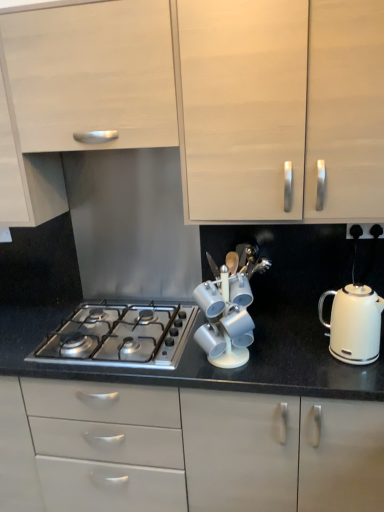
Question: Does white glossy kettle at right have a lesser height compared to stainless steel gas stove at center?

Choices:
 (A) no
 (B) yes

Answer: (A)

Question: Does white glossy kettle at right have a greater width compared to stainless steel gas stove at center?

Choices:
 (A) yes
 (B) no

Answer: (B)

Question: From a real-world perspective, is white glossy kettle at right positioned over stainless steel gas stove at center based on gravity?

Choices:
 (A) no
 (B) yes

Answer: (B)

Question: Can you confirm if white glossy kettle at right is thinner than stainless steel gas stove at center?

Choices:
 (A) yes
 (B) no

Answer: (A)

Question: Does white glossy kettle at right have a greater height compared to stainless steel gas stove at center?

Choices:
 (A) no
 (B) yes

Answer: (B)

Question: Does white glossy kettle at right have a smaller size compared to stainless steel gas stove at center?

Choices:
 (A) no
 (B) yes

Answer: (B)

Question: Can you confirm if white glossy kettle at right is taller than matte white cabinet at upper left, arranged as the third cabinetry when ordered from the bottom?

Choices:
 (A) yes
 (B) no

Answer: (B)

Question: Considering the relative sizes of white glossy kettle at right and matte white cabinet at upper left, which appears as the 2th cabinetry when viewed from the top, in the image provided, is white glossy kettle at right smaller than matte white cabinet at upper left, which appears as the 2th cabinetry when viewed from the top,?

Choices:
 (A) yes
 (B) no

Answer: (A)

Question: From a real-world perspective, is white glossy kettle at right positioned over matte white cabinet at upper left, which appears as the 2th cabinetry when viewed from the top, based on gravity?

Choices:
 (A) no
 (B) yes

Answer: (A)

Question: Does white glossy kettle at right lie in front of matte white cabinet at upper left, arranged as the third cabinetry when ordered from the bottom?

Choices:
 (A) no
 (B) yes

Answer: (B)

Question: From the image's perspective, is white glossy kettle at right located above matte white cabinet at upper left, arranged as the third cabinetry when ordered from the bottom?

Choices:
 (A) no
 (B) yes

Answer: (A)

Question: Is white glossy kettle at right positioned with its back to matte white cabinet at upper left, which appears as the 2th cabinetry when viewed from the top?

Choices:
 (A) no
 (B) yes

Answer: (A)

Question: Is stainless steel gas stove at center closer to the viewer compared to matte white cabinet at upper left, arranged as the third cabinetry when ordered from the bottom?

Choices:
 (A) no
 (B) yes

Answer: (A)